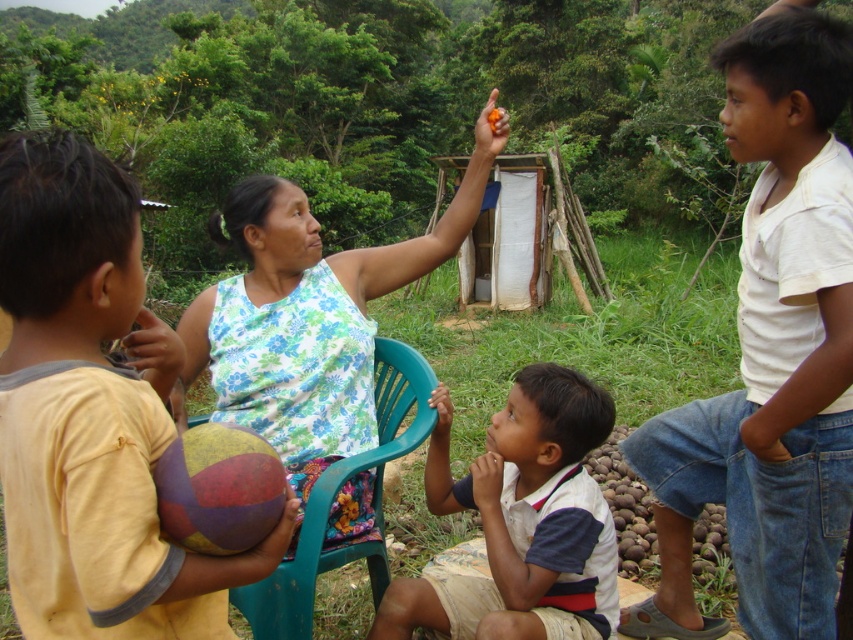
Question: Observing the image, what is the correct spatial positioning of white cotton shirt at right in reference to teal plastic chair at center?

Choices:
 (A) below
 (B) above

Answer: (B)

Question: Which object appears farthest from the camera in this image?

Choices:
 (A) teal plastic chair at center
 (B) white cotton shirt at center

Answer: (B)

Question: Does yellow cotton shirt at left appear under white cotton shirt at center?

Choices:
 (A) no
 (B) yes

Answer: (A)

Question: Which point appears farthest from the camera in this image?

Choices:
 (A) (90, 243)
 (B) (817, 381)
 (C) (498, 540)
 (D) (270, 337)

Answer: (D)

Question: Does white cotton shirt at right have a larger size compared to yellow cotton shirt at left?

Choices:
 (A) yes
 (B) no

Answer: (A)

Question: Which object appears farthest from the camera in this image?

Choices:
 (A) teal plastic chair at center
 (B) white cotton shirt at center
 (C) white cotton shirt at right
 (D) floral fabric dress at center

Answer: (B)